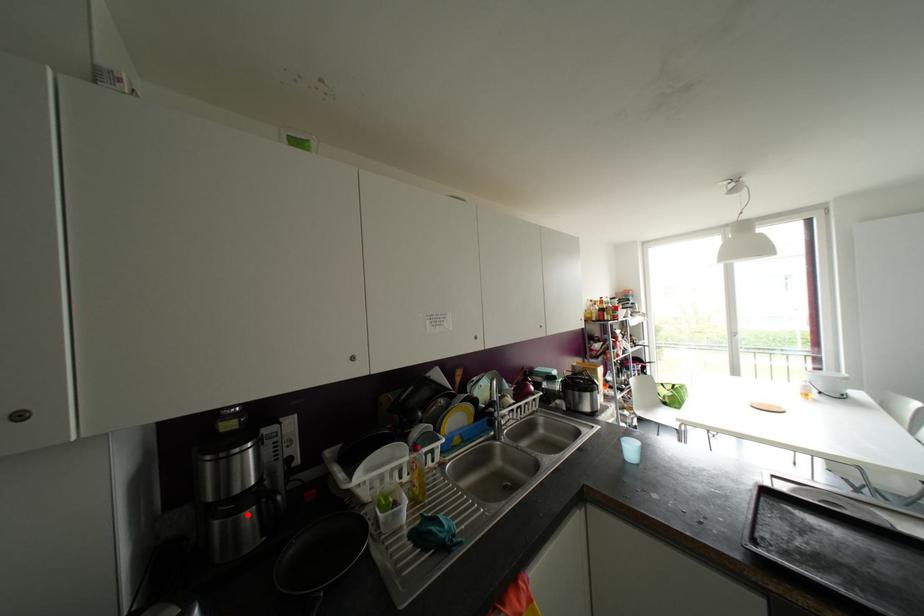
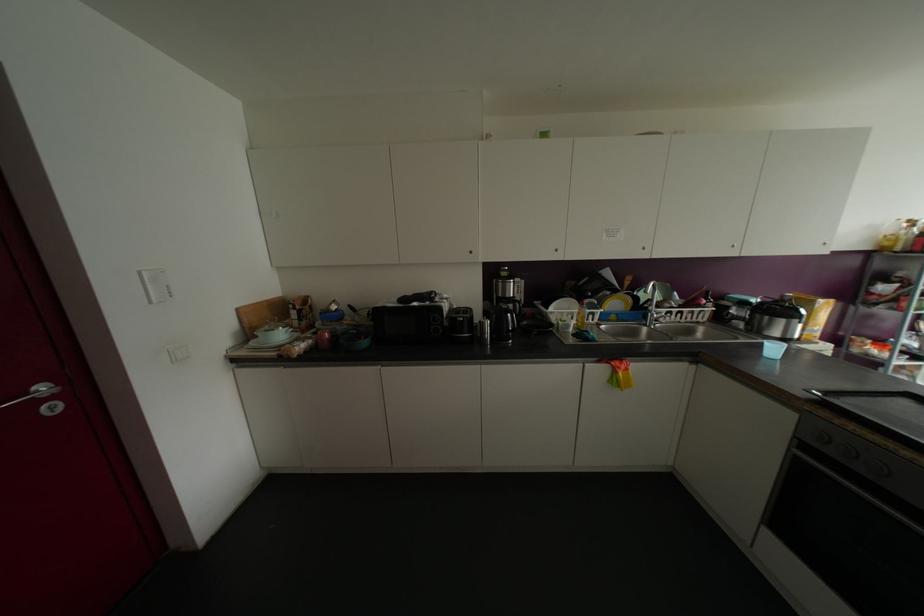
Locate, in the second image, the point that corresponds to the highlighted location in the first image.

(509, 306)